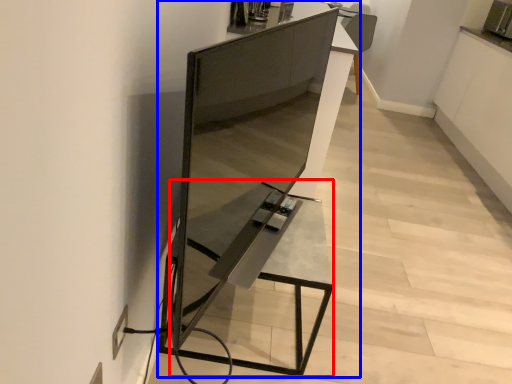
Question: Which point is further to the camera, table (highlighted by a red box) or furniture (highlighted by a blue box)?

Choices:
 (A) table
 (B) furniture

Answer: (A)